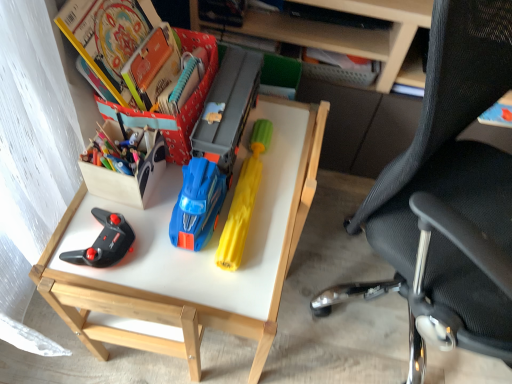
Where is `free point in front of wooden box at left`? free point in front of wooden box at left is located at coordinates (128, 253).